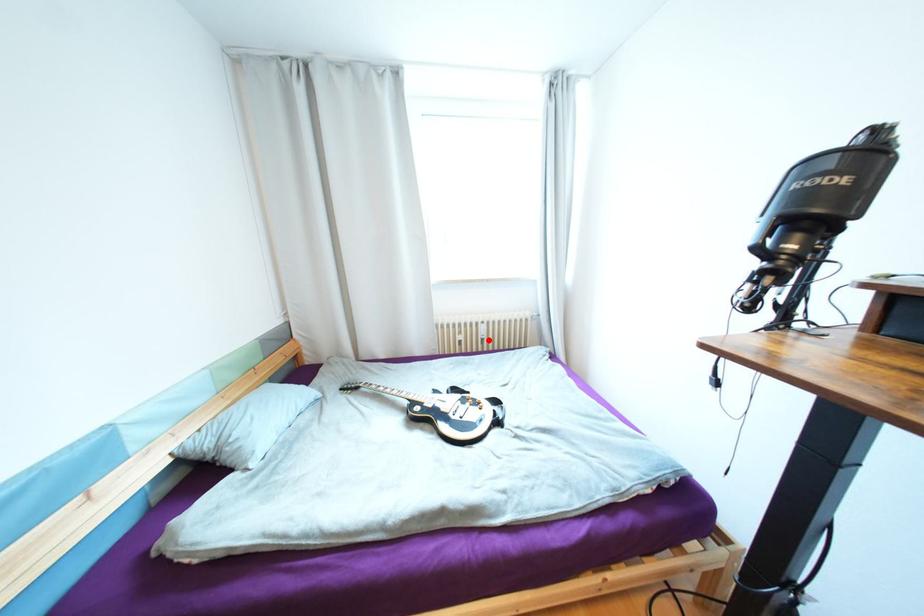
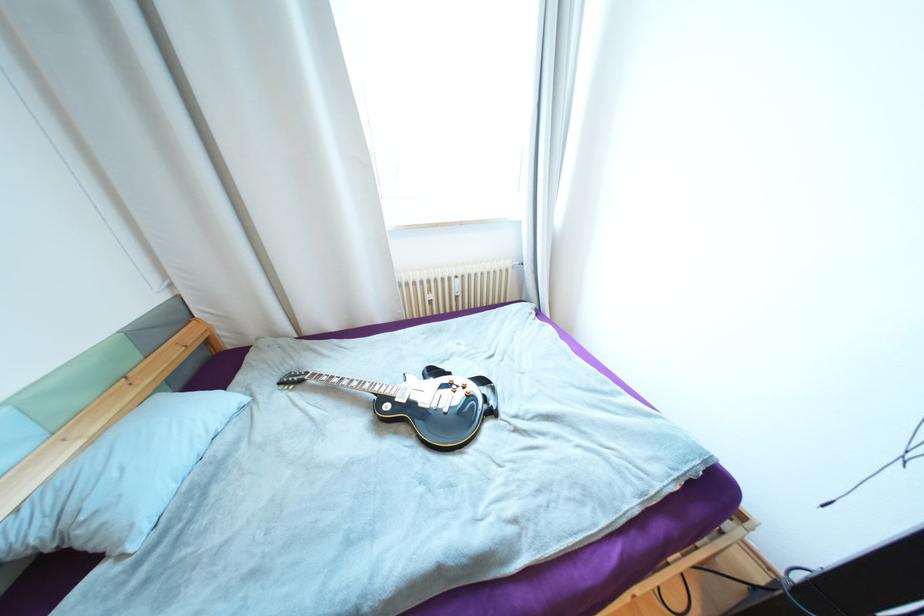
Question: I am providing you with two images of the same scene from different viewpoints. A red point is marked on the first image. Is the red point's position out of view in image 2?

Choices:
 (A) Yes
 (B) No

Answer: (B)